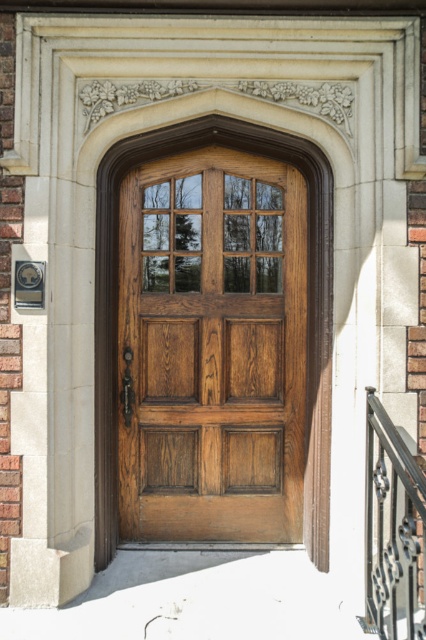
At what (x,y) coordinates should I click in order to perform the action: click on wooden door at center. Please return your answer as a coordinate pair (x, y). Looking at the image, I should click on [212, 348].